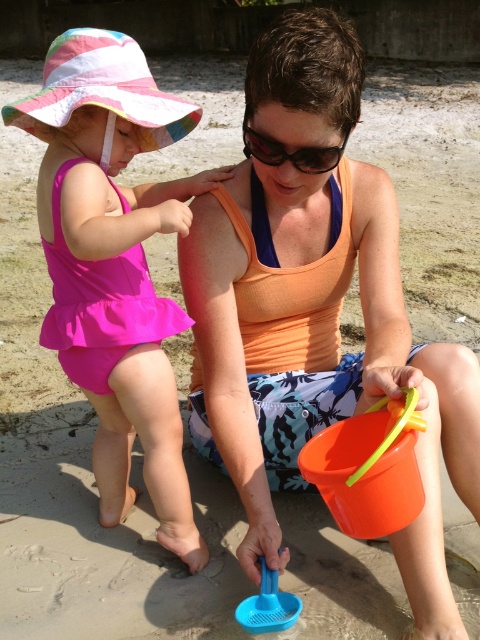
You are a photographer trying to capture a candid shot of the pink fabric swimsuit at left and the orange plastic bucket at lower center. Since you want both subjects to be in focus, which one should you focus on first to ensure the other is also sharp?

The pink fabric swimsuit at left is closer to you than the orange plastic bucket at lower center. To ensure both are in focus, focus on the orange plastic bucket at lower center, which is farther away, as the depth of field will naturally include the closer subject.

You are standing on the beach and see two points marked in the sand. The first point is at coordinates point (214, 237) and the second is at point (251, 141). Which point is closer to you?

Point (214, 237) is further to the viewer than point (251, 141), so the point closer to you is point (251, 141).